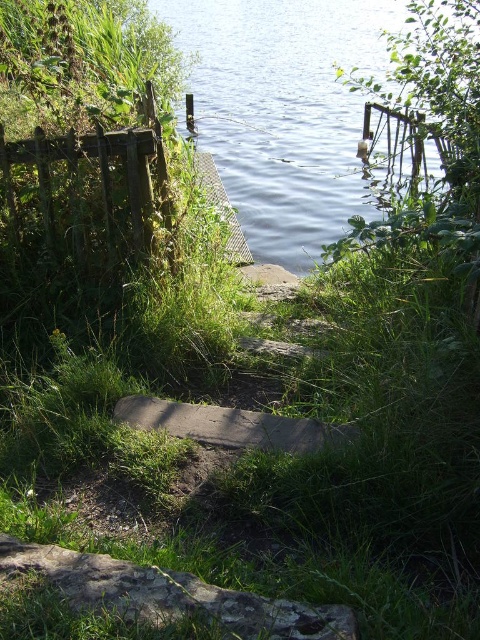
Is blue water at upper center thinner than brown stone path at center?

No.

What do you see at coordinates (287, 109) in the screenshot?
I see `blue water at upper center` at bounding box center [287, 109].

At what (x,y) coordinates should I click in order to perform the action: click on blue water at upper center. Please return your answer as a coordinate pair (x, y). This screenshot has height=640, width=480. Looking at the image, I should click on (287, 109).